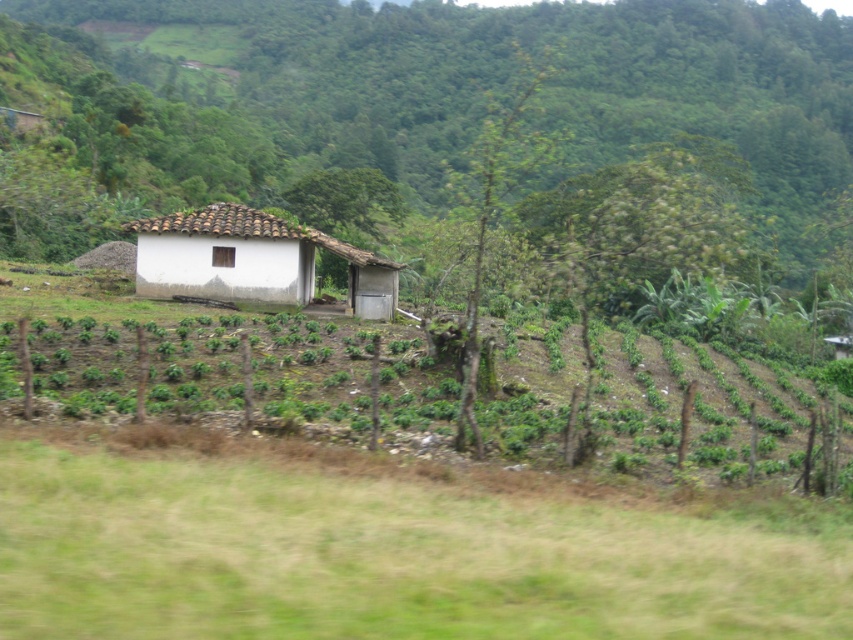
You are standing in the middle of the rural scene and want to walk towards the white matte house at center and the green leafy plants at center. Which one should you walk towards first if you want to reach the one that is closer to you?

The white matte house at center is to the left of green leafy plants at center, so if you want to reach the closer one first, you should walk towards the white matte house at center because objects to the left are typically closer in such scenes.

You are a visitor approaching the white clay hut at center and the transparent glass window at center. Which structure will appear bigger to you as you walk towards them?

The white clay hut at center will appear bigger than the transparent glass window at center because it has a larger size compared to it.

You are standing at the point marked as point (578, 54) in the rural scene. The house is located near you. If you want to reach the dense forested hillside in the background, should you move towards the house or away from it?

Since the point (578, 54) is 560.02 feet away from the viewer, you should move towards the house to reach the dense forested hillside in the background because the hillside is in the background, which is behind the house and further away from the viewer.